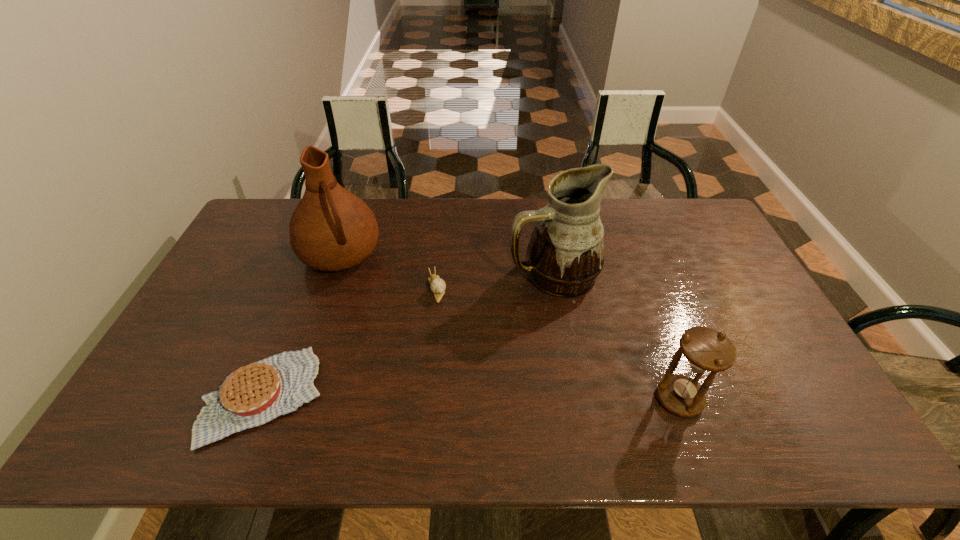
At what (x,y) coordinates should I click in order to perform the action: click on object at the left edge. Please return your answer as a coordinate pair (x, y). The height and width of the screenshot is (540, 960). Looking at the image, I should click on click(252, 395).

Locate an element on the screen. The height and width of the screenshot is (540, 960). object situated at the near left corner is located at coordinates (252, 395).

You are a GUI agent. You are given a task and a screenshot of the screen. Output one action in this format:
    pyautogui.click(x=<x>, y=<y>)
    Task: Click on the vacant space at the far edge of the desktop
    
    Given the screenshot: What is the action you would take?
    pyautogui.click(x=480, y=238)

In order to click on free point at the near edge in this screenshot , I will do `click(461, 379)`.

Where is `vacant space at the left edge`? This screenshot has height=540, width=960. vacant space at the left edge is located at coordinates (213, 289).

In the image, there is a desktop. Where is `free space at the far left corner`? The width and height of the screenshot is (960, 540). free space at the far left corner is located at coordinates (266, 213).

Image resolution: width=960 pixels, height=540 pixels. What are the coordinates of `vacant area at the far right corner of the desktop` in the screenshot? It's located at (695, 237).

At what (x,y) coordinates should I click in order to perform the action: click on vacant space in between the right pitcher and the escargot. Please return your answer as a coordinate pair (x, y). Looking at the image, I should click on (494, 281).

Find the location of a particular element. vacant space that is in between the escargot and the right pitcher is located at coordinates (494, 281).

Where is `free space between the pie and the left pitcher`? This screenshot has width=960, height=540. free space between the pie and the left pitcher is located at coordinates (302, 326).